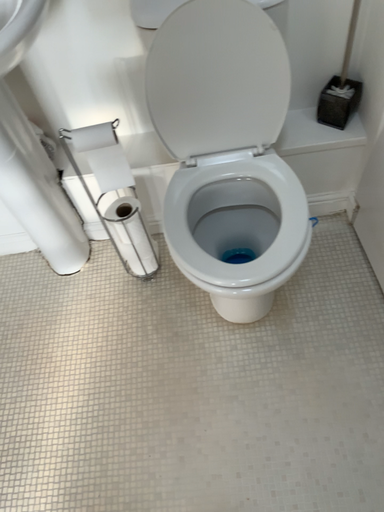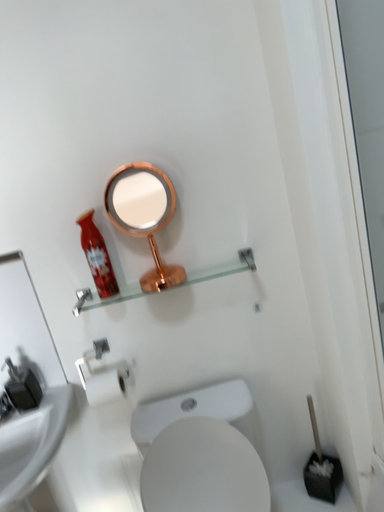
Question: Which way did the camera rotate in the video?

Choices:
 (A) rotated upward
 (B) rotated downward

Answer: (A)